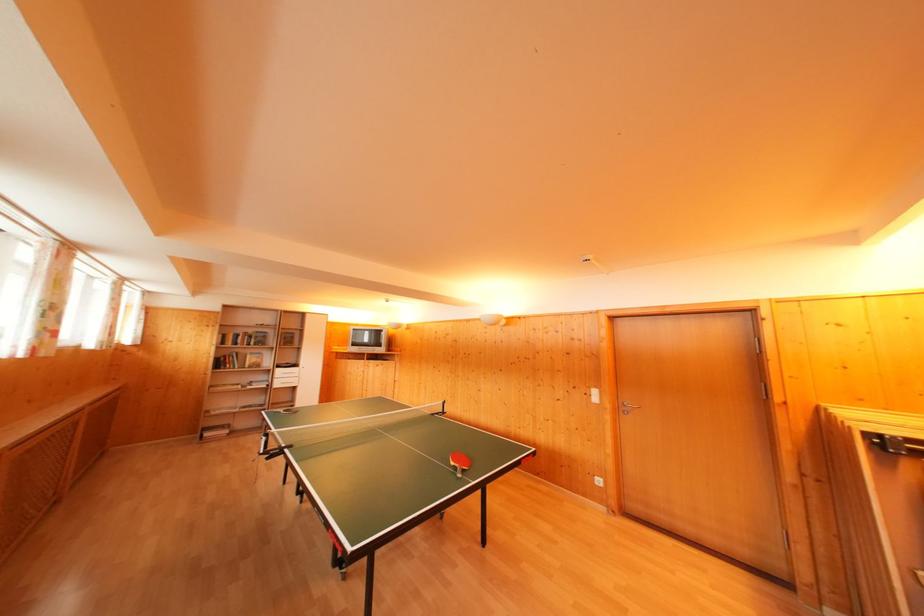
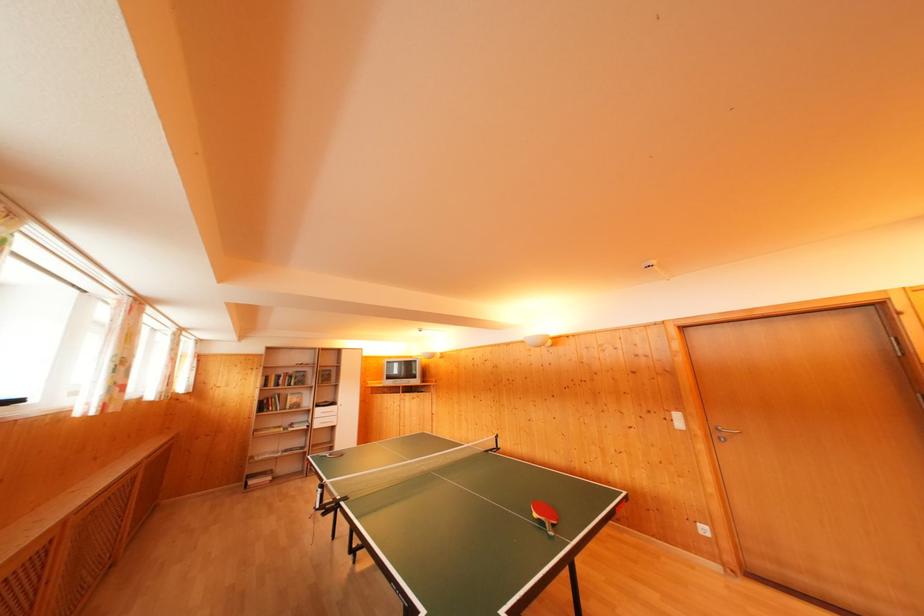
In the second image, find the point that corresponds to (x=603, y=487) in the first image.

(709, 535)